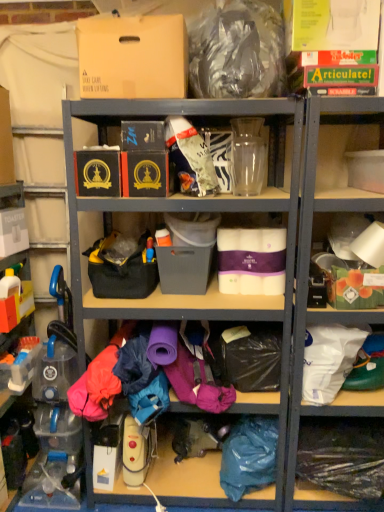
Question: Is white matte tissue box at center, the sixth storage box in the left-to-right sequence, positioned in front of clear plastic bottle at lower left, the 2th shelf from the left?

Choices:
 (A) yes
 (B) no

Answer: (B)

Question: Does white matte tissue box at center, the second storage box from the right, have a greater width compared to clear plastic bottle at lower left, the fourth shelf in the right-to-left sequence?

Choices:
 (A) no
 (B) yes

Answer: (A)

Question: From a real-world perspective, is white matte tissue box at center, the second storage box from the right, positioned over clear plastic bottle at lower left, the 2th shelf from the left, based on gravity?

Choices:
 (A) yes
 (B) no

Answer: (A)

Question: Is there a large distance between white matte tissue box at center, the second storage box from the right, and clear plastic bottle at lower left, the fourth shelf in the right-to-left sequence?

Choices:
 (A) yes
 (B) no

Answer: (A)

Question: Is white matte tissue box at center, the sixth storage box in the left-to-right sequence, looking in the opposite direction of clear plastic bottle at lower left, the fourth shelf in the right-to-left sequence?

Choices:
 (A) yes
 (B) no

Answer: (B)

Question: Is clear plastic bag at lower right, the third shelf positioned from the left, bigger or smaller than clear plastic bottle at lower left, the fourth shelf in the right-to-left sequence?

Choices:
 (A) big
 (B) small

Answer: (A)

Question: Is clear plastic bag at lower right, placed as the third shelf when sorted from right to left, wider or thinner than clear plastic bottle at lower left, the 2th shelf from the left?

Choices:
 (A) wide
 (B) thin

Answer: (A)

Question: Is clear plastic bag at lower right, placed as the third shelf when sorted from right to left, inside the boundaries of clear plastic bottle at lower left, the fourth shelf in the right-to-left sequence, or outside?

Choices:
 (A) inside
 (B) outside

Answer: (B)

Question: Considering their positions, is clear plastic bag at lower right, the third shelf positioned from the left, located in front of or behind clear plastic bottle at lower left, the 2th shelf from the left?

Choices:
 (A) front
 (B) behind

Answer: (A)

Question: Choose the correct answer: Is white paper towel at right, arranged as the fourth shelf when viewed from the left, inside clear plastic bottle at lower left, the 2th shelf from the left, or outside it?

Choices:
 (A) inside
 (B) outside

Answer: (B)

Question: In the image, is white paper towel at right, the second shelf when ordered from right to left, positioned in front of or behind clear plastic bottle at lower left, the 2th shelf from the left?

Choices:
 (A) behind
 (B) front

Answer: (B)

Question: Based on their sizes in the image, would you say white paper towel at right, arranged as the fourth shelf when viewed from the left, is bigger or smaller than clear plastic bottle at lower left, the 2th shelf from the left?

Choices:
 (A) small
 (B) big

Answer: (B)

Question: From the image's perspective, is white paper towel at right, arranged as the fourth shelf when viewed from the left, positioned above or below clear plastic bottle at lower left, the 2th shelf from the left?

Choices:
 (A) above
 (B) below

Answer: (A)

Question: Which is correct: matte plastic storage box at center, placed as the 5th storage box when sorted from left to right, is inside clear plastic bottles at left, which is counted as the 1th shelf, starting from the left, or outside of it?

Choices:
 (A) outside
 (B) inside

Answer: (A)

Question: From a real-world perspective, is matte plastic storage box at center, placed as the 5th storage box when sorted from left to right, physically located above or below clear plastic bottles at left, acting as the fifth shelf starting from the right?

Choices:
 (A) below
 (B) above

Answer: (B)